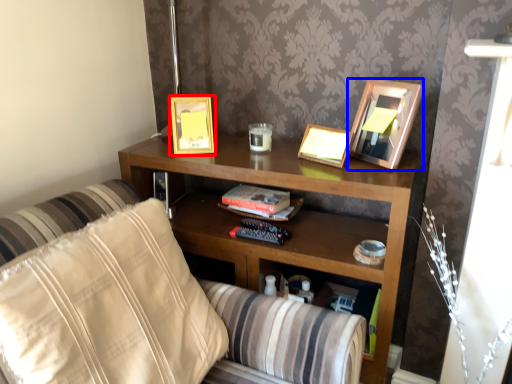
Question: Which of the following is the closest to the observer, picture frame (highlighted by a red box) or picture frame (highlighted by a blue box)?

Choices:
 (A) picture frame
 (B) picture frame

Answer: (B)